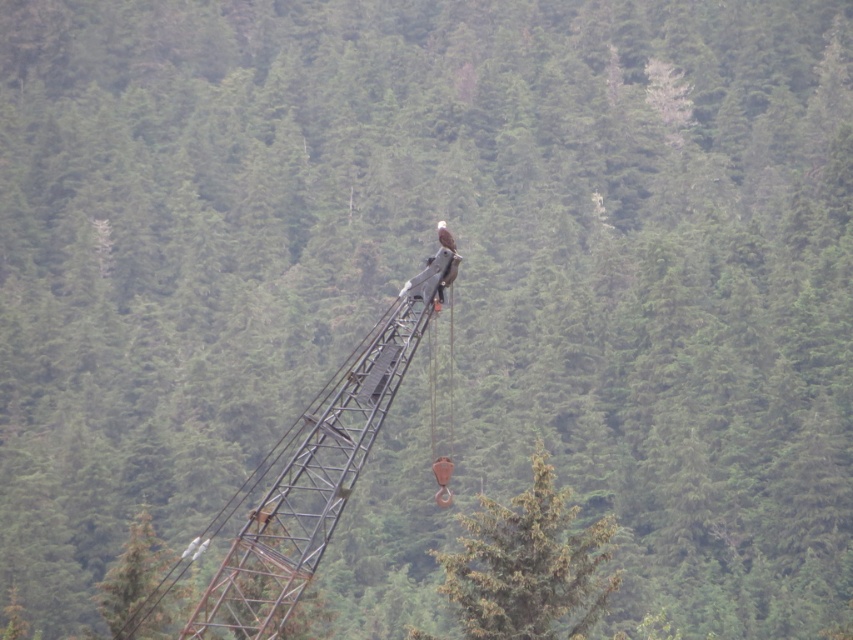
Question: Which of the following is the farthest from the observer?

Choices:
 (A) (245, 552)
 (B) (577, 588)

Answer: (B)

Question: Does rusty metal crane at center come behind green matte tree at center?

Choices:
 (A) yes
 (B) no

Answer: (B)

Question: Which point is farther to the camera?

Choices:
 (A) (294, 554)
 (B) (537, 480)

Answer: (B)

Question: Can you confirm if rusty metal crane at center is positioned below green matte tree at center?

Choices:
 (A) yes
 (B) no

Answer: (B)

Question: Considering the relative positions of rusty metal crane at center and green matte tree at center in the image provided, where is rusty metal crane at center located with respect to green matte tree at center?

Choices:
 (A) left
 (B) right

Answer: (A)